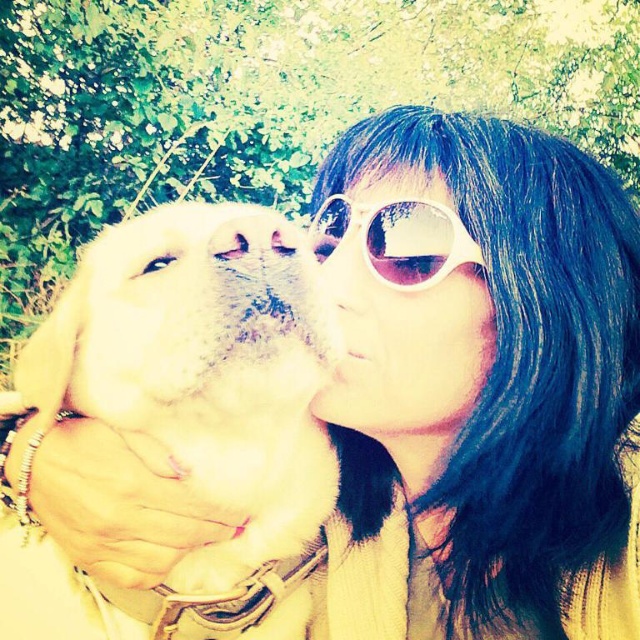
Question: Based on their relative distances, which object is farther from the white matte sunglasses at upper center?

Choices:
 (A) white plastic goggles at center
 (B) white fur dog at left

Answer: (B)

Question: In this image, where is white matte sunglasses at upper center located relative to white plastic goggles at center?

Choices:
 (A) right
 (B) left

Answer: (B)

Question: Which point appears closest to the camera in this image?

Choices:
 (A) (486, 323)
 (B) (396, 248)

Answer: (A)

Question: Is white fur dog at left to the left of white plastic goggles at center from the viewer's perspective?

Choices:
 (A) yes
 (B) no

Answer: (A)

Question: Does white fur dog at left appear over white matte sunglasses at upper center?

Choices:
 (A) no
 (B) yes

Answer: (A)

Question: Which object is closer to the camera taking this photo?

Choices:
 (A) white plastic goggles at center
 (B) white matte sunglasses at upper center

Answer: (B)